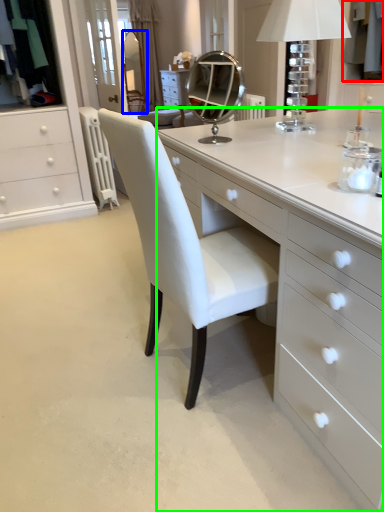
Question: Which object is the closest to the clothing (highlighted by a red box)? Choose among these: mirror (highlighted by a blue box) or table (highlighted by a green box).

Choices:
 (A) mirror
 (B) table

Answer: (B)